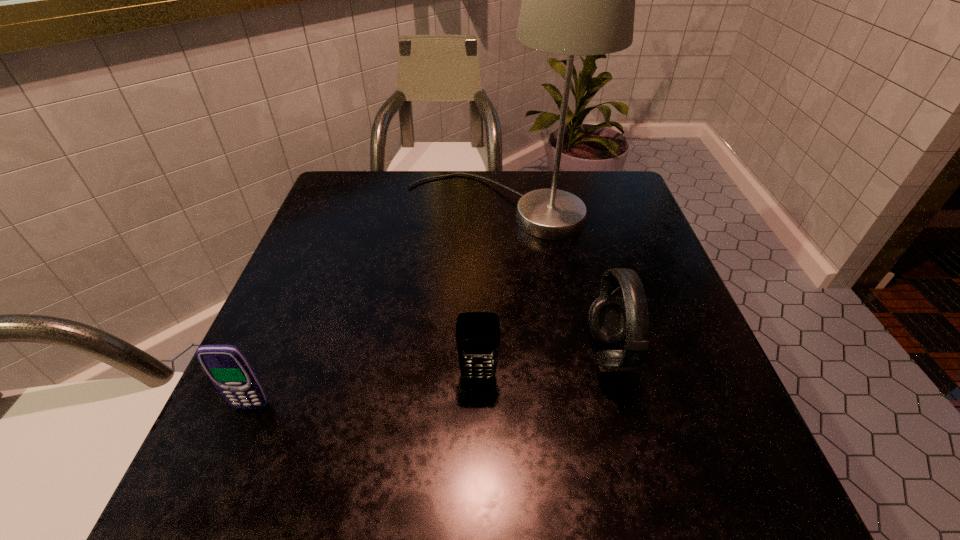
Identify the location of free location located 0.070m on the front-facing side of the left cellular telephone. This screenshot has height=540, width=960. (231, 453).

This screenshot has height=540, width=960. I want to click on object at the far edge, so [x=579, y=0].

Find the location of `object at the left edge`. object at the left edge is located at coordinates (227, 367).

The image size is (960, 540). Identify the location of table lamp that is positioned at the right edge. (579, 0).

The height and width of the screenshot is (540, 960). Find the location of `headset situated at the right edge`. headset situated at the right edge is located at coordinates (613, 320).

Locate an element on the screen. This screenshot has height=540, width=960. object situated at the far right corner is located at coordinates (579, 0).

The image size is (960, 540). In order to click on free space at the far edge in this screenshot , I will do `click(440, 193)`.

In the image, there is a desktop. Where is `vacant space at the left edge`? Image resolution: width=960 pixels, height=540 pixels. vacant space at the left edge is located at coordinates (323, 263).

This screenshot has height=540, width=960. What are the coordinates of `vacant space at the right edge of the desktop` in the screenshot? It's located at (620, 233).

The height and width of the screenshot is (540, 960). Identify the location of blank area at the far left corner. (366, 178).